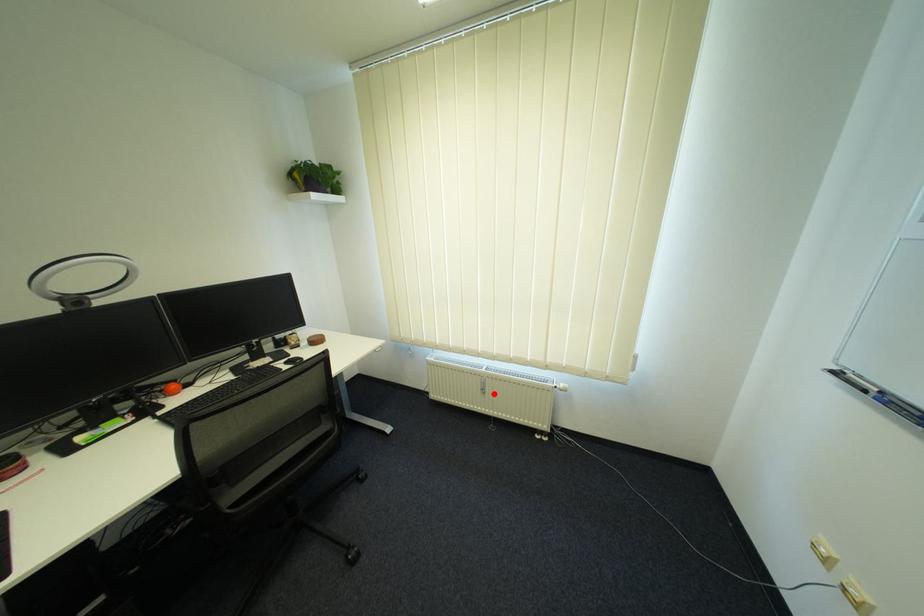
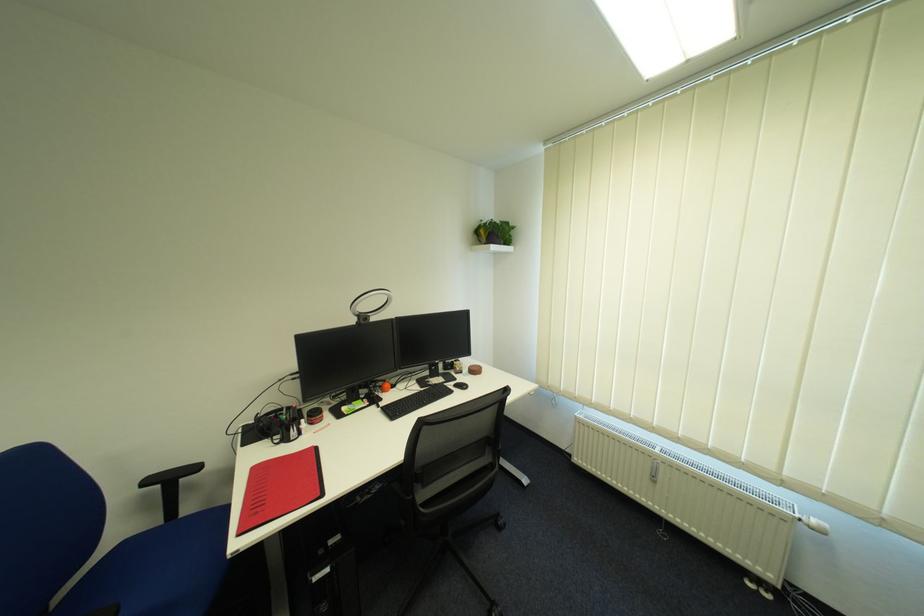
Question: I am providing you with two images of the same scene from different viewpoints. In image1, a red point is highlighted. Considering the same 3D point in image2, which of the following is correct?

Choices:
 (A) It is closer
 (B) It is farther

Answer: (A)